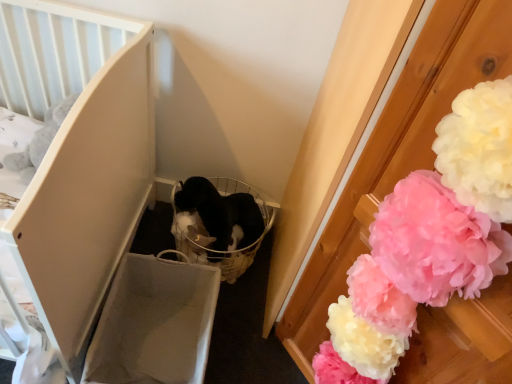
Describe the element at coordinates (78, 158) in the screenshot. I see `matte white crib at left` at that location.

Identify the location of matte white crib at left. (78, 158).

Image resolution: width=512 pixels, height=384 pixels. What do you see at coordinates (428, 240) in the screenshot?
I see `white fluffy pom-pom at right` at bounding box center [428, 240].

This screenshot has width=512, height=384. In order to click on white fluffy pom-pom at right in this screenshot , I will do `click(428, 240)`.

Where is `matte white crib at left`? This screenshot has width=512, height=384. matte white crib at left is located at coordinates (78, 158).

Consider the image. Is matte white crib at left to the left or to the right of white fluffy pom-pom at right in the image?

Based on their positions, matte white crib at left is located to the left of white fluffy pom-pom at right.

Between matte white crib at left and white fluffy pom-pom at right, which one is positioned in front?

white fluffy pom-pom at right is in front.

Considering the points (77, 15) and (447, 241), which point is in front, point (77, 15) or point (447, 241)?

Point (447, 241)

From the image's perspective, is matte white crib at left over white fluffy pom-pom at right?

Correct, matte white crib at left appears higher than white fluffy pom-pom at right in the image.

From a real-world perspective, does matte white crib at left stand above white fluffy pom-pom at right?

Actually, matte white crib at left is physically below white fluffy pom-pom at right in the real world.

Can you confirm if matte white crib at left is thinner than white fluffy pom-pom at right?

No, matte white crib at left is not thinner than white fluffy pom-pom at right.

In terms of height, does matte white crib at left look taller or shorter compared to white fluffy pom-pom at right?

In the image, matte white crib at left appears to be shorter than white fluffy pom-pom at right.

Considering the relative sizes of matte white crib at left and white fluffy pom-pom at right in the image provided, is matte white crib at left smaller than white fluffy pom-pom at right?

No, matte white crib at left is not smaller than white fluffy pom-pom at right.

Is white fluffy pom-pom at right surrounded by matte white crib at left?

Actually, white fluffy pom-pom at right is outside matte white crib at left.

Would you say matte white crib at left is a long distance from white fluffy pom-pom at right?

No, matte white crib at left is not far away from white fluffy pom-pom at right.

Is matte white crib at left facing away from white fluffy pom-pom at right?

No.

How different are the orientations of matte white crib at left and white fluffy pom-pom at right in degrees?

They differ by 49.2 degrees in their facing directions.

I want to click on furniture on the left of white fluffy pom-pom at right, so click(78, 158).

From the picture: Which object is positioned more to the left, white fluffy pom-pom at right or matte white crib at left?

From the viewer's perspective, matte white crib at left appears more on the left side.

Which is in front, white fluffy pom-pom at right or matte white crib at left?

white fluffy pom-pom at right is more forward.

Which is closer, (480, 275) or (81, 287)?

The point (480, 275) is closer.

From the image's perspective, is white fluffy pom-pom at right beneath matte white crib at left?

Yes.

From a real-world perspective, which is physically below, white fluffy pom-pom at right or matte white crib at left?

matte white crib at left is physically lower.

Is white fluffy pom-pom at right wider or thinner than matte white crib at left?

Answer: In the image, white fluffy pom-pom at right appears to be more narrow than matte white crib at left.

Which of these two, white fluffy pom-pom at right or matte white crib at left, stands taller?

With more height is white fluffy pom-pom at right.

Looking at this image, considering the relative sizes of white fluffy pom-pom at right and matte white crib at left in the image provided, is white fluffy pom-pom at right bigger than matte white crib at left?

No.

Would you say white fluffy pom-pom at right is outside matte white crib at left?

Indeed, white fluffy pom-pom at right is completely outside matte white crib at left.

Are white fluffy pom-pom at right and matte white crib at left located far from each other?

white fluffy pom-pom at right is near matte white crib at left, not far away.

Is white fluffy pom-pom at right oriented away from matte white crib at left?

No, white fluffy pom-pom at right is not facing away from matte white crib at left.

How much distance is there between white fluffy pom-pom at right and matte white crib at left?

white fluffy pom-pom at right and matte white crib at left are 74.71 centimeters apart.

This screenshot has width=512, height=384. Identify the location of furniture on the left of white fluffy pom-pom at right. (x=78, y=158).

At what (x,y) coordinates should I click in order to perform the action: click on furniture that appears on the left of white fluffy pom-pom at right. Please return your answer as a coordinate pair (x, y). This screenshot has width=512, height=384. Looking at the image, I should click on (78, 158).

Find the location of `flower below the matte white crib at left (from the image's perspective)`. flower below the matte white crib at left (from the image's perspective) is located at coordinates (428, 240).